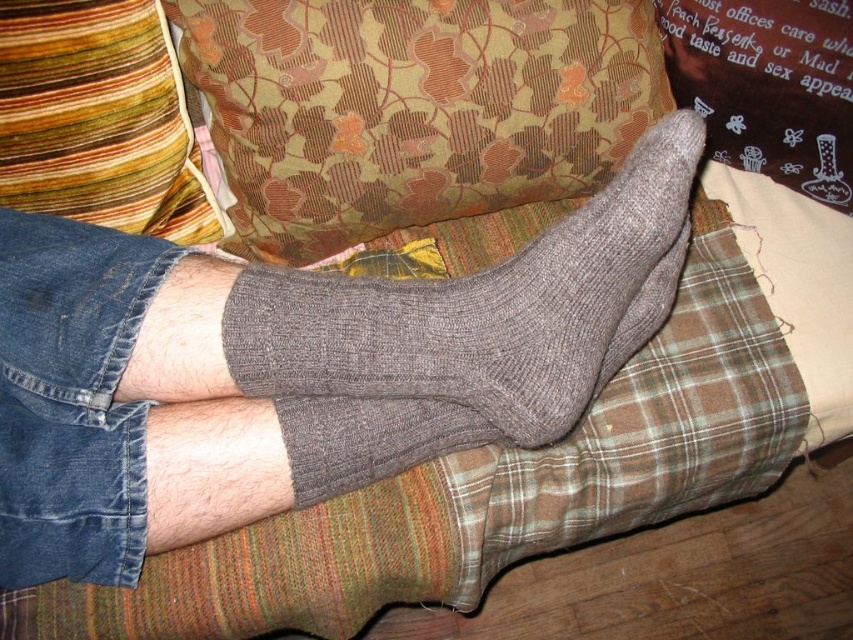
Between gray knitted sock at upper center and multicolored striped pillow at upper left, which one has less height?

multicolored striped pillow at upper left

Does gray knitted sock at upper center have a smaller size compared to multicolored striped pillow at upper left?

No.

Which is behind, point (642, 157) or point (103, 186)?

The point (103, 186) is behind.

Identify the location of gray knitted sock at upper center. The height and width of the screenshot is (640, 853). (473, 324).

Can you confirm if brown textured pillow at upper center is positioned below gray knitted sock at upper center?

Actually, brown textured pillow at upper center is above gray knitted sock at upper center.

Who is more forward, (495,202) or (532,304)?

Point (532,304)

Image resolution: width=853 pixels, height=640 pixels. Identify the location of brown textured pillow at upper center. (410, 108).

Can you confirm if brown textured pillow at upper center is positioned below denim shorts at lower left?

Incorrect, brown textured pillow at upper center is not positioned below denim shorts at lower left.

Who is more distant from viewer, [283,40] or [115,436]?

The point [283,40] is behind.

This screenshot has height=640, width=853. Find the location of `brown textured pillow at upper center`. brown textured pillow at upper center is located at coordinates (410, 108).